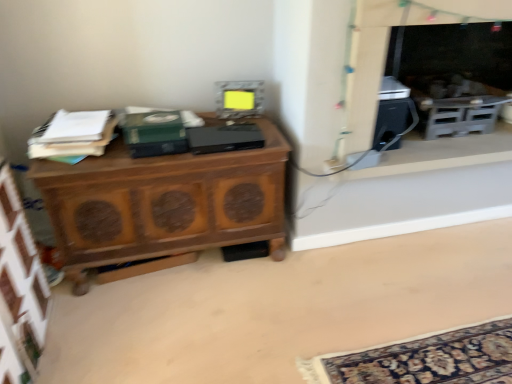
This screenshot has height=384, width=512. In order to click on space that is in front of wooden cabinet at left in this screenshot , I will do `click(175, 321)`.